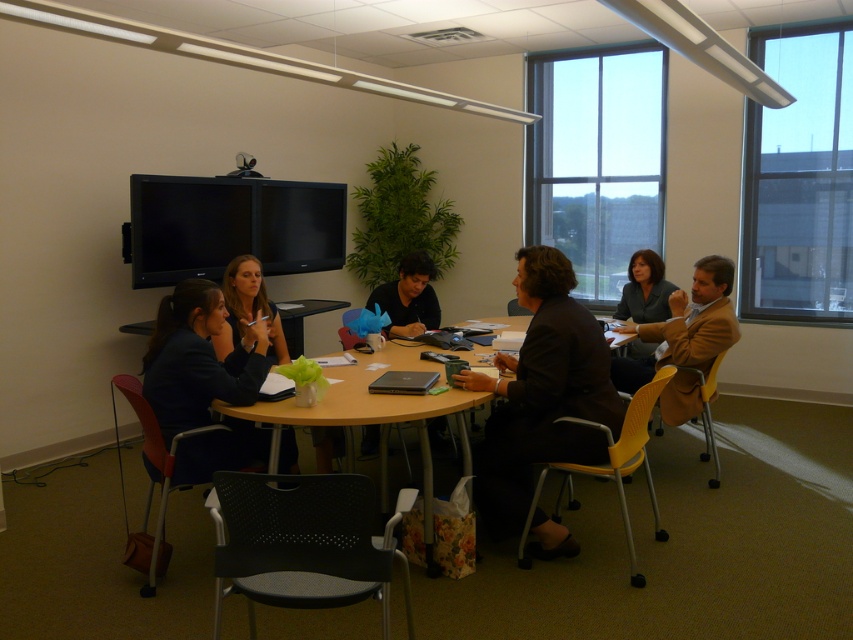
Is matte black blazer at lower left wider than wooden round table at center?

No, matte black blazer at lower left is not wider than wooden round table at center.

Locate an element on the screen. Image resolution: width=853 pixels, height=640 pixels. matte black blazer at lower left is located at coordinates (196, 358).